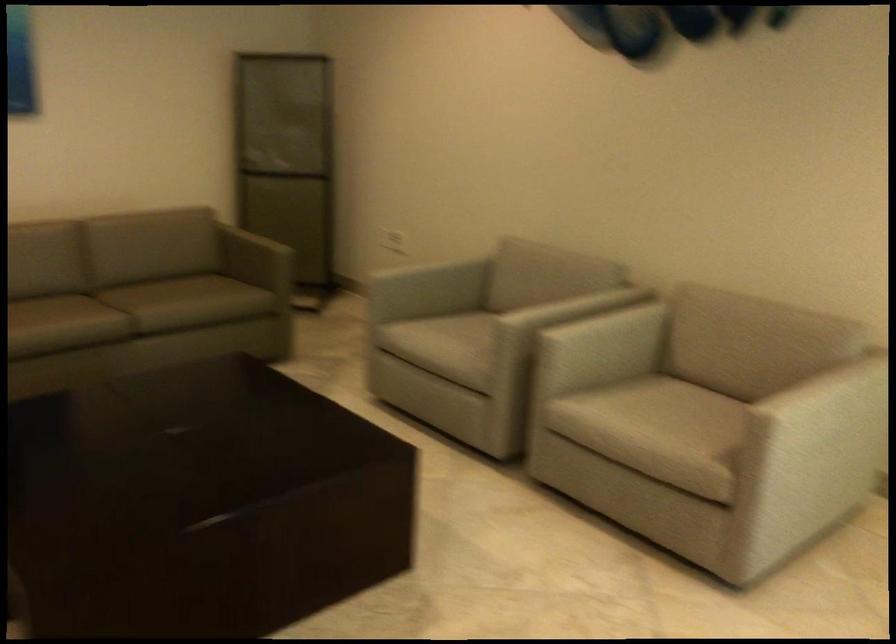
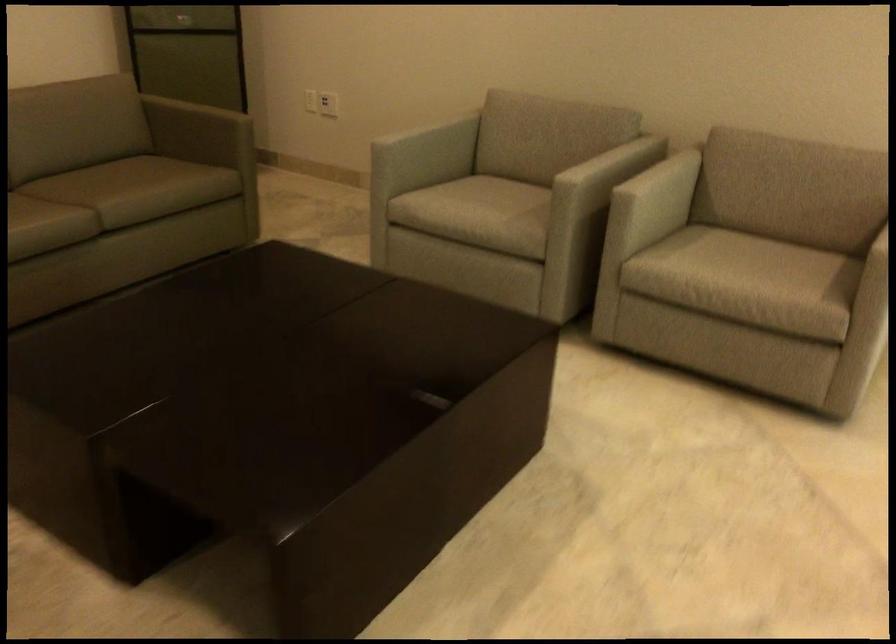
The point at (450, 341) is marked in the first image. Where is the corresponding point in the second image?

(480, 207)